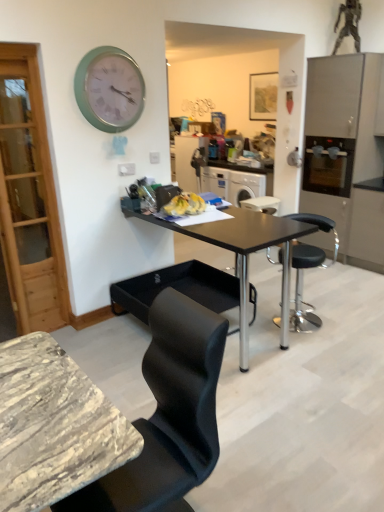
Question: Which is correct: satin silver cabinet at right is inside black matte table at center, or outside of it?

Choices:
 (A) outside
 (B) inside

Answer: (A)

Question: Looking at their shapes, would you say satin silver cabinet at right is wider or thinner than black matte table at center?

Choices:
 (A) wide
 (B) thin

Answer: (B)

Question: Which is nearer to the black leather bar stool at center?

Choices:
 (A) black matte table at center
 (B) wooden picture frame at upper center
 (C) satin silver cabinet at right
 (D) satin silver oven at right
 (E) teal metallic clock at upper left

Answer: (A)

Question: Estimate the real-world distances between objects in this image. Which object is farther from the satin silver cabinet at right?

Choices:
 (A) black matte table at center
 (B) satin silver oven at right
 (C) teal metallic clock at upper left
 (D) wooden picture frame at upper center
 (E) black leather bar stool at center

Answer: (D)